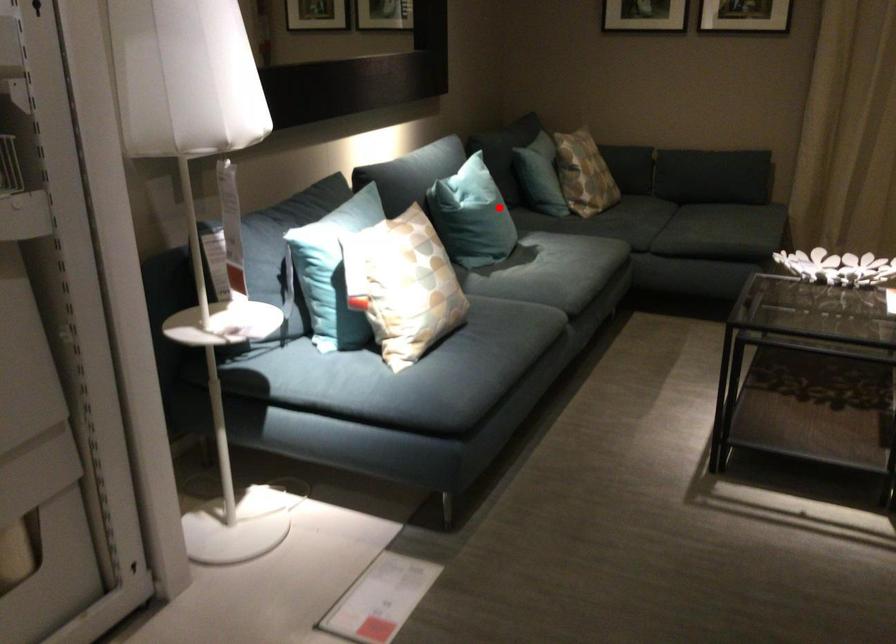
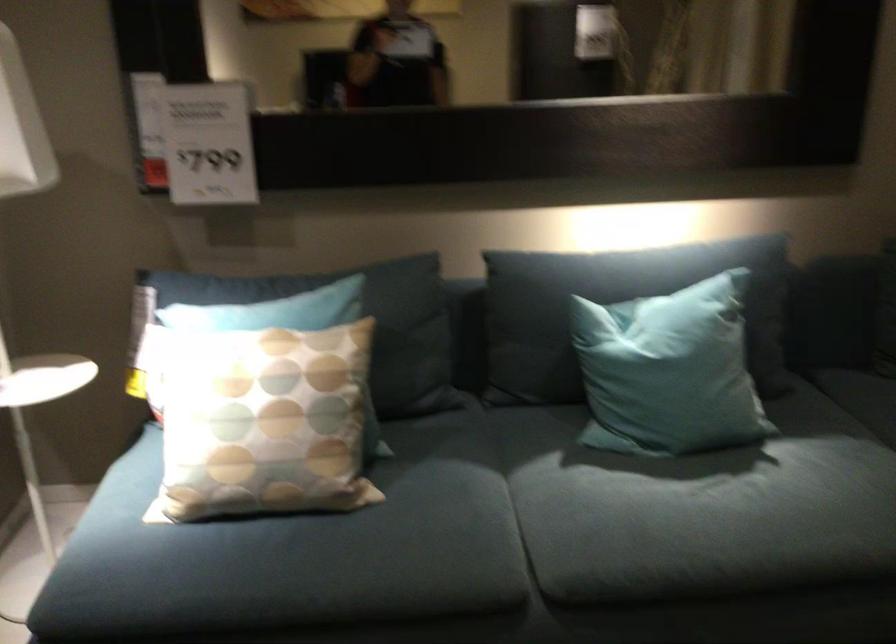
The point at the highlighted location is marked in the first image. Where is the corresponding point in the second image?

(668, 371)